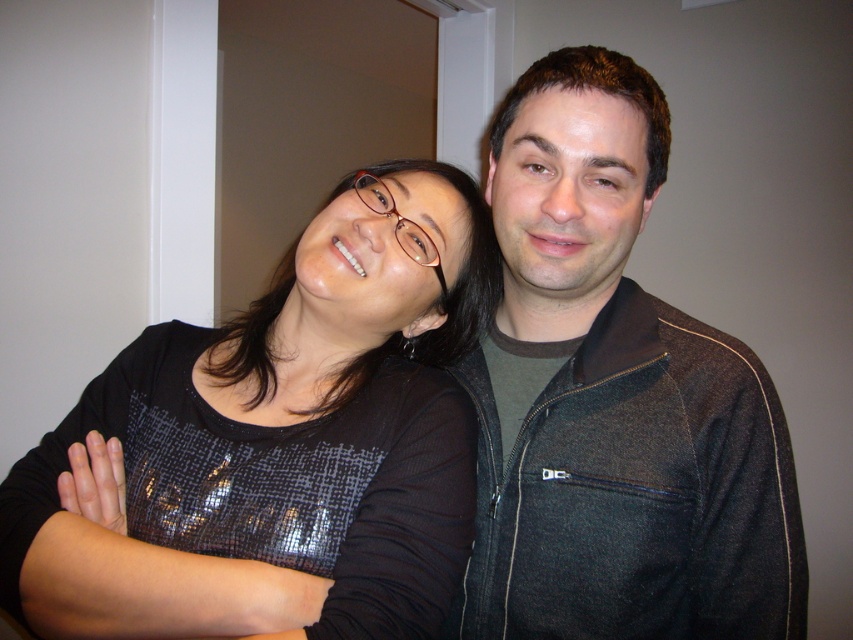
Question: Which of the following is the closest to the observer?

Choices:
 (A) (721, 547)
 (B) (13, 529)

Answer: (B)

Question: Is black sequined top at center bigger than dark gray fleece jacket at center?

Choices:
 (A) no
 (B) yes

Answer: (B)

Question: Can you confirm if black sequined top at center is positioned above dark gray fleece jacket at center?

Choices:
 (A) no
 (B) yes

Answer: (A)

Question: Which object is farther from the camera taking this photo?

Choices:
 (A) dark gray fleece jacket at center
 (B) black sequined top at center

Answer: (A)

Question: Does black sequined top at center have a lesser width compared to dark gray fleece jacket at center?

Choices:
 (A) no
 (B) yes

Answer: (A)